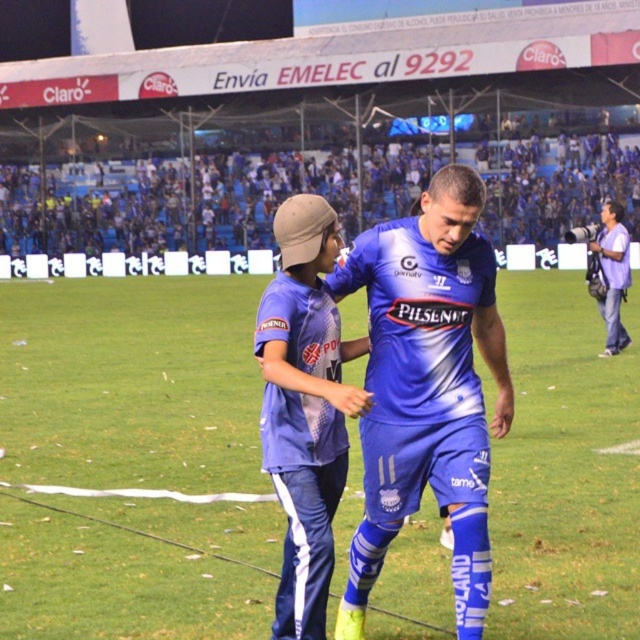
Does blue jersey at center have a greater height compared to matte blue tracksuit at center?

Indeed, blue jersey at center has a greater height compared to matte blue tracksuit at center.

The height and width of the screenshot is (640, 640). What do you see at coordinates (428, 387) in the screenshot?
I see `blue jersey at center` at bounding box center [428, 387].

The width and height of the screenshot is (640, 640). In order to click on blue jersey at center in this screenshot , I will do `click(428, 387)`.

Between blue fabric football field at center and matte blue tracksuit at center, which one has more height?

Standing taller between the two is blue fabric football field at center.

Consider the image. Can you confirm if blue fabric football field at center is positioned above matte blue tracksuit at center?

Correct, blue fabric football field at center is located above matte blue tracksuit at center.

I want to click on blue fabric football field at center, so click(140, 404).

Which is behind, point (456, 275) or point (611, 202)?

The point (611, 202) is behind.

Can you confirm if blue jersey at center is thinner than purple cotton shirt at right?

No, blue jersey at center is not thinner than purple cotton shirt at right.

Does point (442, 200) come behind point (611, 209)?

That is False.

Find the location of a particular element. blue jersey at center is located at coordinates point(428,387).